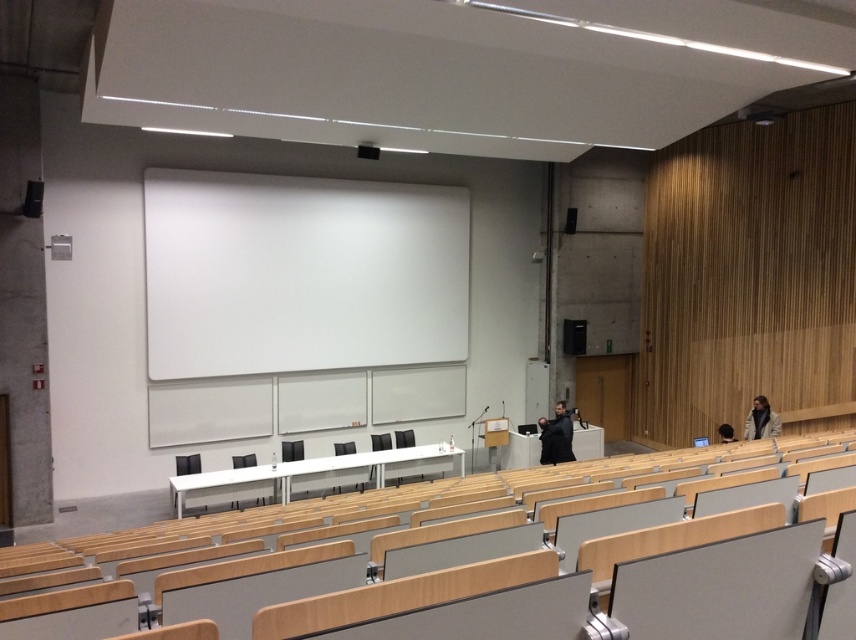
Is black matte speaker at upper left closer to the viewer compared to black matte speaker at upper right?

Yes, black matte speaker at upper left is in front of black matte speaker at upper right.

Can you confirm if black matte speaker at upper left is positioned to the right of black matte speaker at upper right?

In fact, black matte speaker at upper left is to the left of black matte speaker at upper right.

The width and height of the screenshot is (856, 640). Identify the location of black matte speaker at upper left. (33, 198).

Find the location of a particular element. black matte speaker at upper left is located at coordinates (33, 198).

Between point (263, 195) and point (39, 214), which one is positioned in front?

Point (39, 214) is more forward.

What do you see at coordinates (300, 273) in the screenshot? I see `white matte projection screen at center` at bounding box center [300, 273].

The width and height of the screenshot is (856, 640). I want to click on white matte projection screen at center, so click(x=300, y=273).

Can you confirm if white matte projection screen at center is positioned to the right of black matte speaker at upper right?

In fact, white matte projection screen at center is to the left of black matte speaker at upper right.

Is point (162, 182) positioned in front of point (569, 209)?

That is True.

I want to click on white matte projection screen at center, so click(300, 273).